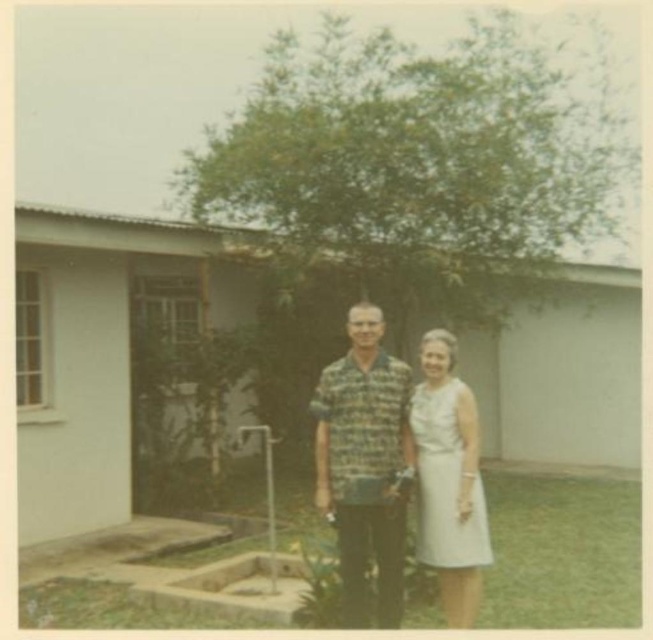
Question: Which object is farther from the camera taking this photo?

Choices:
 (A) white satin dress at center
 (B) printed cotton shirt at center

Answer: (A)

Question: Can you confirm if printed cotton shirt at center is bigger than white satin dress at center?

Choices:
 (A) yes
 (B) no

Answer: (B)

Question: Which point is closer to the camera?

Choices:
 (A) (439, 467)
 (B) (328, 404)

Answer: (B)

Question: Does printed cotton shirt at center have a lesser width compared to white satin dress at center?

Choices:
 (A) yes
 (B) no

Answer: (B)

Question: Is printed cotton shirt at center bigger than white satin dress at center?

Choices:
 (A) no
 (B) yes

Answer: (A)